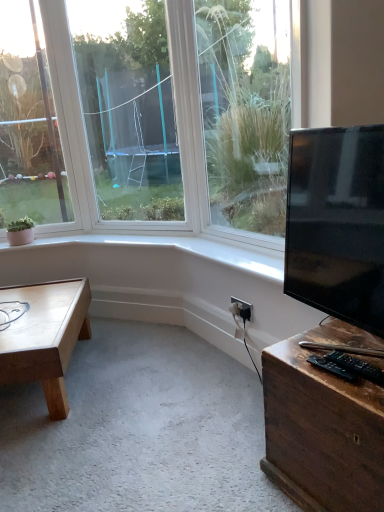
You are a GUI agent. You are given a task and a screenshot of the screen. Output one action in this format:
    pyautogui.click(x=<x>, y=<y>)
    Task: Click on the free space in front of black plastic remote control at lower right, which is counted as the first wide, starting from the left
    
    Given the screenshot: What is the action you would take?
    pyautogui.click(x=352, y=396)